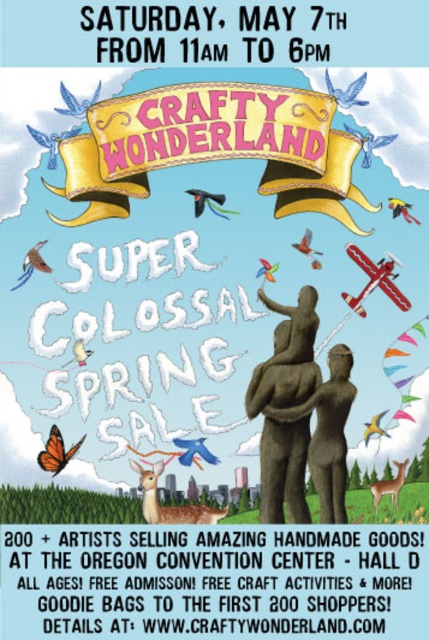
Can you confirm if matte stone statue at center is bigger than red matte airplane at upper right?

Yes, matte stone statue at center is bigger than red matte airplane at upper right.

Is matte stone statue at center shorter than red matte airplane at upper right?

No.

Locate an element on the screen. The height and width of the screenshot is (640, 429). matte stone statue at center is located at coordinates (286, 406).

Consider the image. Is orange paper kite at lower left bigger than red matte kite at upper right?

Yes.

Describe the element at coordinates (57, 451) in the screenshot. I see `orange paper kite at lower left` at that location.

I want to click on orange paper kite at lower left, so click(x=57, y=451).

You are a GUI agent. You are given a task and a screenshot of the screen. Output one action in this format:
    pyautogui.click(x=<x>, y=<y>)
    Task: Click on the orange paper kite at lower left
    
    Given the screenshot: What is the action you would take?
    pyautogui.click(x=57, y=451)

Between orange paper kite at lower left and yellow paper kite at center, which one is positioned higher?

yellow paper kite at center is above.

Between point (75, 449) and point (383, 413), which one is positioned in front?

Point (75, 449)

I want to click on orange paper kite at lower left, so click(57, 451).